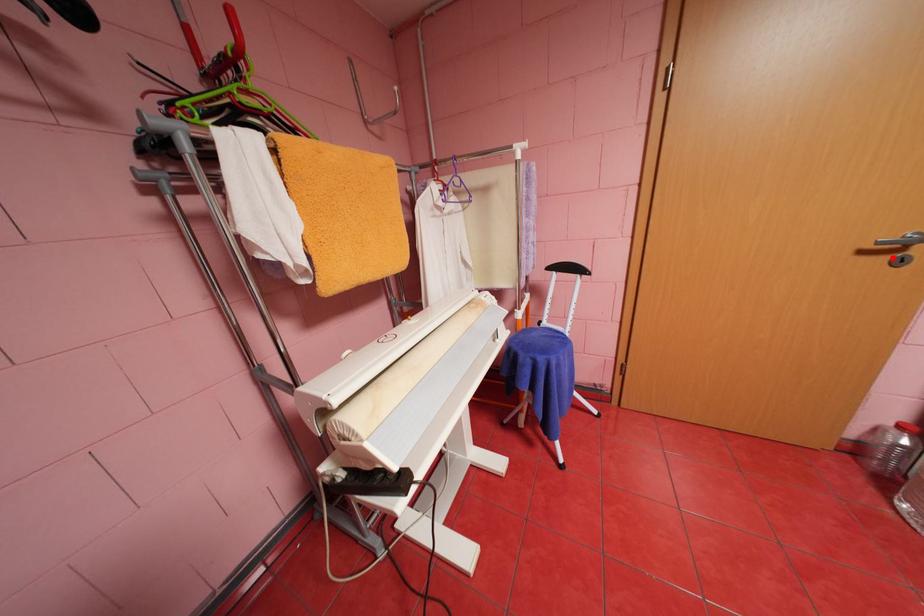
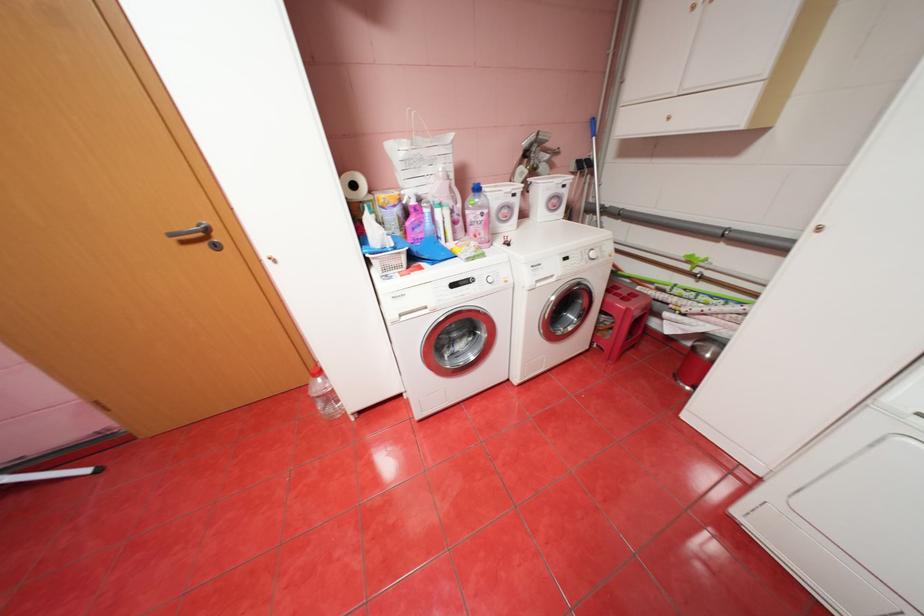
Question: I am providing you with two images of the same scene from different viewpoints. Image1 has a red point marked. In image2, the corresponding 3D location appears at what relative position? Reply with the corresponding letter.

Choices:
 (A) Closer
 (B) Farther

Answer: (A)